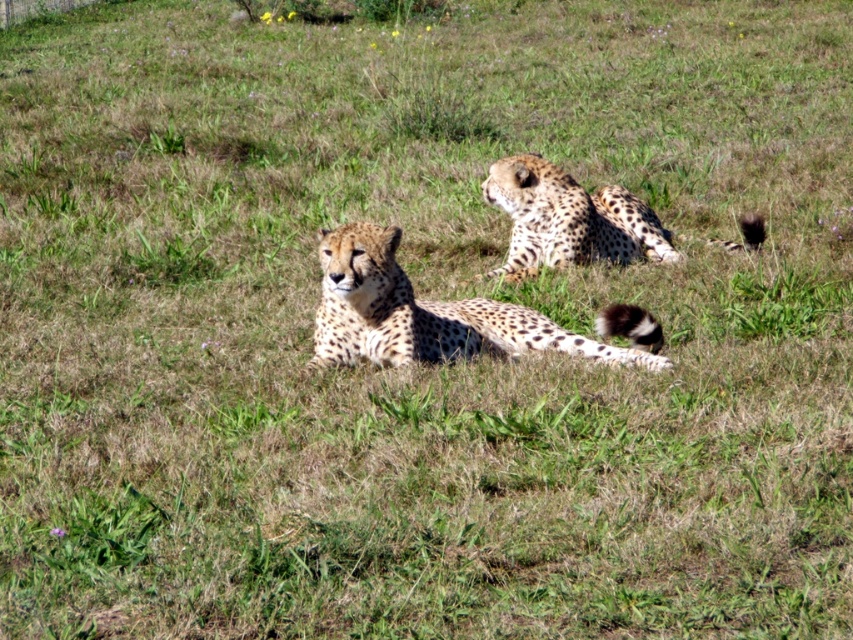
Is the position of spotted fur cheetah at center more distant than that of spotted fur cheetah at upper right?

No, spotted fur cheetah at center is in front of spotted fur cheetah at upper right.

This screenshot has width=853, height=640. What are the coordinates of `spotted fur cheetah at center` in the screenshot? It's located at (424, 314).